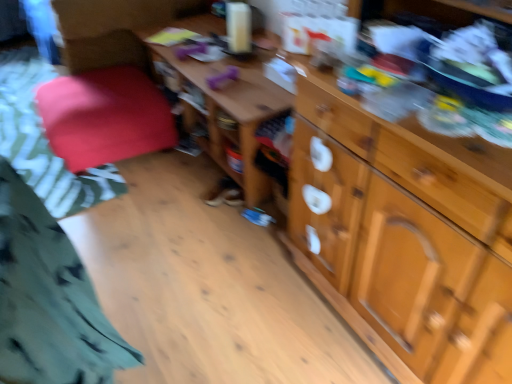
Where is `velvet red cushion at left`? The image size is (512, 384). velvet red cushion at left is located at coordinates (104, 117).

Identify the location of velvet red cushion at left. Image resolution: width=512 pixels, height=384 pixels. (44, 141).

What is the approximate height of velvet red cushion at left?

The height of velvet red cushion at left is 5.48 centimeters.

The width and height of the screenshot is (512, 384). What do you see at coordinates (49, 300) in the screenshot? I see `green cotton shirt at lower left` at bounding box center [49, 300].

Identify the location of wooden cabinet at right. The image size is (512, 384). (404, 234).

Measure the distance between point (x=232, y=137) and camera.

Point (x=232, y=137) and camera are 1.88 meters apart from each other.

In order to click on wooden drawer at right in this screenshot , I will do (x=417, y=159).

Can you tell me how much wooden table at center and velvet red cushion at left differ in facing direction?

The angle between the facing direction of wooden table at center and the facing direction of velvet red cushion at left is 0.616 degrees.

In the scene shown: From the image's perspective, which object appears higher, wooden table at center or velvet red cushion at left?

velvet red cushion at left, from the image's perspective.

Considering the sizes of objects wooden table at center and velvet red cushion at left in the image provided, who is smaller, wooden table at center or velvet red cushion at left?

velvet red cushion at left is smaller.

Between point (248, 158) and point (17, 61), which one is positioned in front?

The point (248, 158) is closer.

Is point (411, 264) positioned after point (245, 75)?

No, it is in front of (245, 75).

Does wooden cabinet at right have a smaller size compared to wooden table at center?

Incorrect, wooden cabinet at right is not smaller in size than wooden table at center.

From the image's perspective, is wooden cabinet at right above or below wooden table at center?

Based on their image positions, wooden cabinet at right is located beneath wooden table at center.

From the image's perspective, which one is positioned lower, wooden drawer at right or velvet red cushion at left?

From the image's view, wooden drawer at right is below.

Can you tell me how much wooden drawer at right and velvet red cushion at left differ in facing direction?

wooden drawer at right and velvet red cushion at left are facing 3.38 degrees away from each other.

From the picture: Is wooden drawer at right to the left or to the right of velvet red cushion at left in the image?

wooden drawer at right is positioned on velvet red cushion at left's right side.

Is wooden drawer at right shorter than velvet red cushion at left?

Yes, wooden drawer at right is shorter than velvet red cushion at left.

Which is closer, (19, 107) or (435, 232)?

Point (19, 107) is farther from the camera than point (435, 232).

In the image, there is a wooden cabinet at right. Find the location of `bedding above it (from the image's perspective)`. bedding above it (from the image's perspective) is located at coordinates (44, 141).

Considering the relative sizes of velvet red cushion at left and wooden cabinet at right in the image provided, is velvet red cushion at left bigger than wooden cabinet at right?

Actually, velvet red cushion at left might be smaller than wooden cabinet at right.

How far apart are velvet red cushion at left and wooden cabinet at right?

The distance of velvet red cushion at left from wooden cabinet at right is 4.99 feet.

From the image's perspective, who appears lower, wooden cabinet at right or velvet red cushion at left?

wooden cabinet at right is shown below in the image.

Which of these two, wooden cabinet at right or velvet red cushion at left, is wider?

velvet red cushion at left is wider.

In the scene shown: Is wooden cabinet at right not inside velvet red cushion at left?

That's correct, wooden cabinet at right is outside of velvet red cushion at left.

Which is more to the right, wooden cabinet at right or velvet red cushion at left?

Positioned to the right is wooden cabinet at right.

Which object is further away from the camera taking this photo, green cotton shirt at lower left or velvet red cushion at left?

velvet red cushion at left is behind.

What's the angular difference between green cotton shirt at lower left and velvet red cushion at left's facing directions?

green cotton shirt at lower left and velvet red cushion at left are facing 6.41 degrees away from each other.

Considering the sizes of objects green cotton shirt at lower left and velvet red cushion at left in the image provided, who is wider, green cotton shirt at lower left or velvet red cushion at left?

velvet red cushion at left is wider.

Who is taller, green cotton shirt at lower left or velvet red cushion at left?

green cotton shirt at lower left.

Considering the relative sizes of wooden drawer at right and green cotton shirt at lower left in the image provided, is wooden drawer at right wider than green cotton shirt at lower left?

Yes, wooden drawer at right is wider than green cotton shirt at lower left.

Considering their positions, is wooden drawer at right located in front of or behind green cotton shirt at lower left?

In the image, wooden drawer at right appears behind green cotton shirt at lower left.

The image size is (512, 384). I want to click on bedding above the wooden table at center (from the image's perspective), so click(44, 141).

Locate an element on the screen. Image resolution: width=512 pixels, height=384 pixels. table on the left of wooden cabinet at right is located at coordinates (234, 114).

Considering their positions, is green cotton shirt at lower left positioned further to wooden table at center than velvet red cushion at left?

Based on the image, green cotton shirt at lower left appears to be further to wooden table at center.

From the image, which object appears to be nearer to wooden cabinet at right, wooden drawer at right or wooden table at center?

wooden drawer at right.

Based on their spatial positions, is wooden drawer at right or velvet red cushion at left further from velvet red cushion at left?

The object further to velvet red cushion at left is wooden drawer at right.

When comparing their distances from wooden table at center, does wooden cabinet at right or green cotton shirt at lower left seem closer?

wooden cabinet at right lies closer to wooden table at center than the other object.

When comparing their distances from wooden cabinet at right, does velvet red cushion at left or green cotton shirt at lower left seem further?

The object further to wooden cabinet at right is velvet red cushion at left.

When comparing their distances from velvet red cushion at left, does wooden drawer at right or wooden table at center seem further?

wooden drawer at right lies further to velvet red cushion at left than the other object.

From the image, which object appears to be farther from green cotton shirt at lower left, wooden table at center or wooden cabinet at right?

Among the two, wooden table at center is located further to green cotton shirt at lower left.

Which object lies nearer to the anchor point velvet red cushion at left, wooden cabinet at right or wooden table at center?

Among the two, wooden table at center is located nearer to velvet red cushion at left.

Where is `drawer between green cotton shirt at lower left and wooden table at center from front to back`? drawer between green cotton shirt at lower left and wooden table at center from front to back is located at coordinates (417, 159).

This screenshot has height=384, width=512. Identify the location of stool situated between velvet red cushion at left and wooden cabinet at right from left to right. (104, 117).

I want to click on table between wooden cabinet at right and velvet red cushion at left from front to back, so click(x=234, y=114).

The image size is (512, 384). In order to click on cabinetry between green cotton shirt at lower left and velvet red cushion at left along the z-axis in this screenshot , I will do `click(404, 234)`.